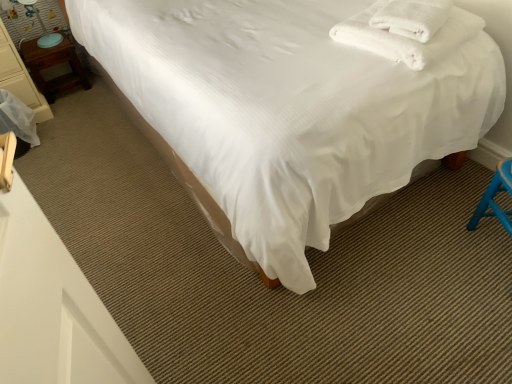
Question: Considering the positions of matte blue table lamp at left and white smooth bed at center in the image, is matte blue table lamp at left wider or thinner than white smooth bed at center?

Choices:
 (A) wide
 (B) thin

Answer: (B)

Question: Considering the positions of point (30, 6) and point (249, 168), is point (30, 6) closer or farther from the camera than point (249, 168)?

Choices:
 (A) closer
 (B) farther

Answer: (B)

Question: Considering the real-world distances, which object is farthest from the matte blue table lamp at left?

Choices:
 (A) white smooth bed at center
 (B) wooden nightstand at left
 (C) wooden nightstand at left
 (D) white soft towel at upper right

Answer: (D)

Question: Which is farther from the matte blue table lamp at left?

Choices:
 (A) wooden nightstand at left
 (B) white smooth bed at center
 (C) wooden nightstand at left
 (D) white soft towel at upper right

Answer: (D)